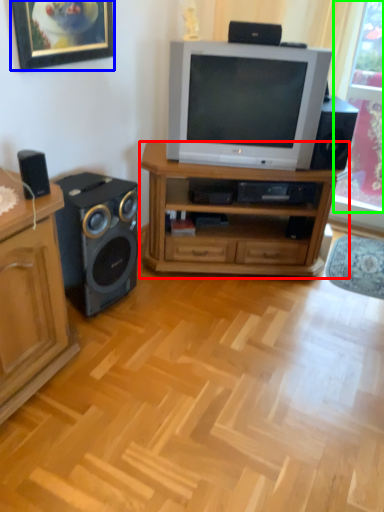
Question: Which is farther away from desk (highlighted by a red box)? picture frame (highlighted by a blue box) or window screen (highlighted by a green box)?

Choices:
 (A) picture frame
 (B) window screen

Answer: (B)